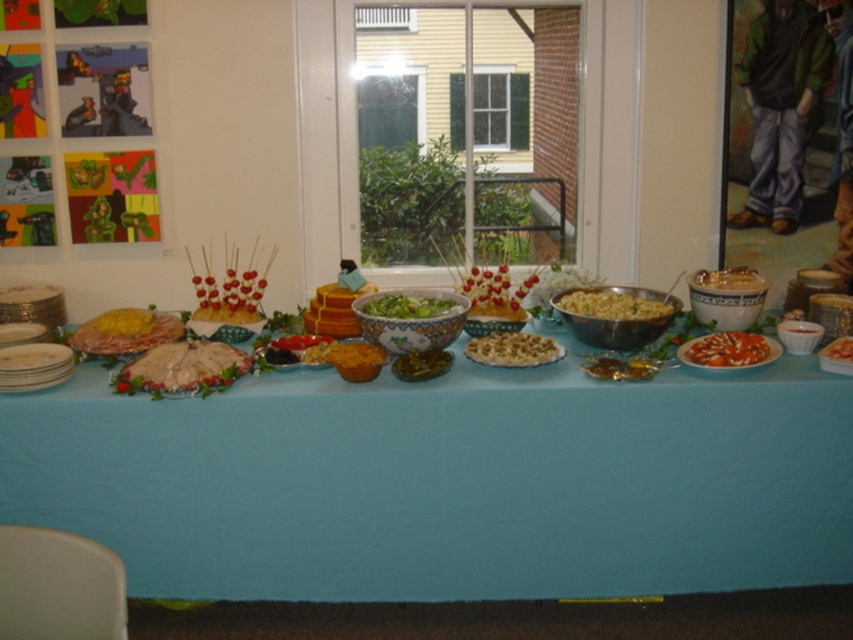
Question: Does white ceramic platter at lower left appear under saucy pasta at center?

Choices:
 (A) yes
 (B) no

Answer: (A)

Question: Which object appears farthest from the camera in this image?

Choices:
 (A) matte ceramic bowl at center
 (B) white creamy spread at center
 (C) blue fabric tablecloth at center

Answer: (A)

Question: Is matte ceramic bowl at center to the right of saucy pasta at center from the viewer's perspective?

Choices:
 (A) no
 (B) yes

Answer: (A)

Question: Which of the following is the closest to the observer?

Choices:
 (A) (86, 301)
 (B) (831, 340)

Answer: (B)

Question: Is white creamy spread at center positioned at the back of white ceramic platter at lower left?

Choices:
 (A) yes
 (B) no

Answer: (A)

Question: Which object appears closest to the camera in this image?

Choices:
 (A) blue fabric tablecloth at center
 (B) white creamy spread at center
 (C) saucy pasta at center

Answer: (A)